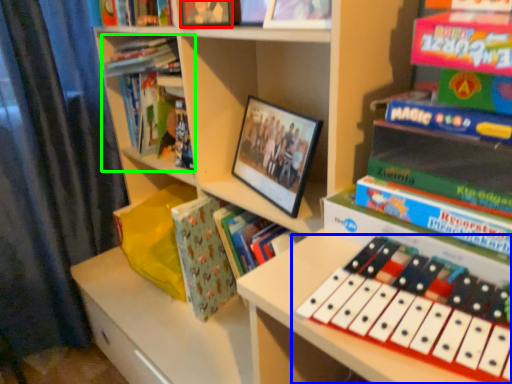
Question: Which object is the closest to the book (highlighted by a red box)? Choose among these: musical keyboard (highlighted by a blue box) or book (highlighted by a green box).

Choices:
 (A) musical keyboard
 (B) book

Answer: (B)